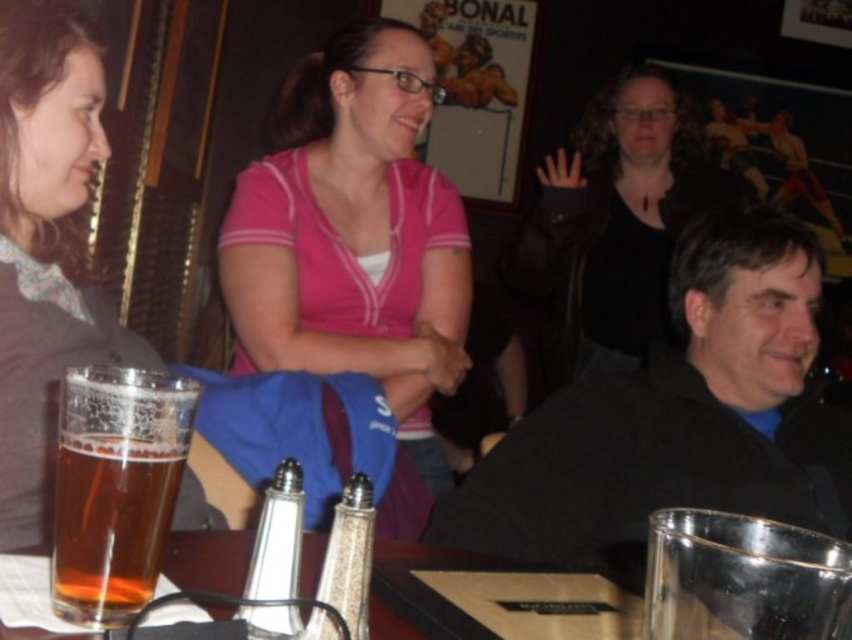
You are a bartender preparing to place a new drink order on the table. The table has limited space. The matte black jacket at upper center and the translucent glass bottle at center are already on the table. Which object takes up more space on the table?

The matte black jacket at upper center has a larger size compared to the translucent glass bottle at center, so it takes up more space on the table.